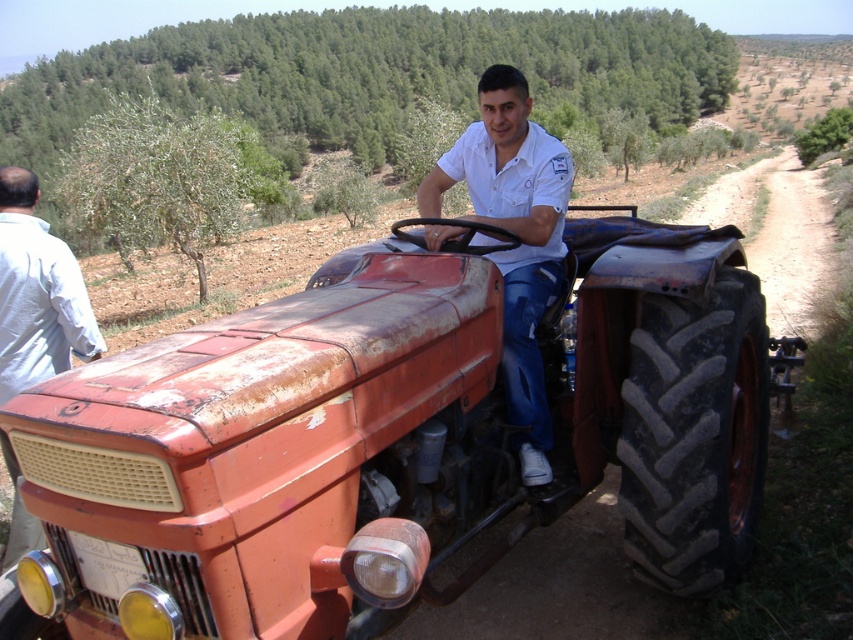
Between rusty metal tractor at center and white cotton shirt at center, which one has less height?

rusty metal tractor at center is shorter.

What are the coordinates of `rusty metal tractor at center` in the screenshot? It's located at (396, 436).

Which is in front, point (720, 579) or point (534, 188)?

Positioned in front is point (720, 579).

I want to click on rusty metal tractor at center, so click(x=396, y=436).

Between rusty metal tractor at center and light blue shirt at left, which one is positioned higher?

light blue shirt at left is above.

From the picture: How far apart are rusty metal tractor at center and light blue shirt at left?

They are 7.05 feet apart.

The image size is (853, 640). I want to click on rusty metal tractor at center, so click(396, 436).

Is white cotton shirt at center positioned at the back of light blue shirt at left?

That is True.

Is point (534, 212) farther from camera compared to point (32, 544)?

Yes, point (534, 212) is farther from viewer.

Where is `white cotton shirt at center`? The image size is (853, 640). white cotton shirt at center is located at coordinates (517, 234).